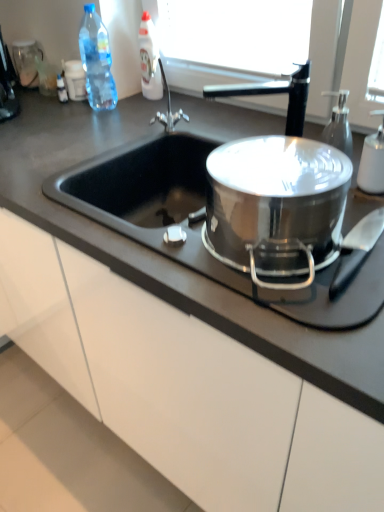
Find the location of a particular element. Image resolution: width=384 pixels, height=512 pixels. free space above stainless steel pot at center (from a real-world perspective) is located at coordinates (277, 170).